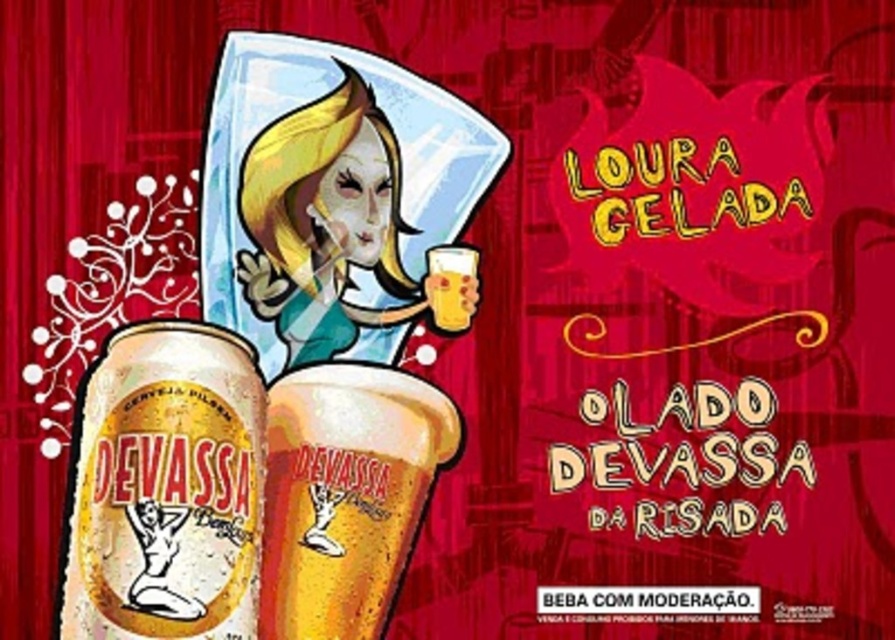
Which is below, translucent plastic cup at center or translucent glass beer at center?

translucent plastic cup at center is below.

Which is more to the right, translucent plastic cup at center or translucent glass beer at center?

translucent glass beer at center is more to the right.

This screenshot has height=640, width=895. I want to click on translucent plastic cup at center, so click(345, 493).

Is translucent plastic cup at center shorter than matte white face at center?

Correct, translucent plastic cup at center is not as tall as matte white face at center.

Consider the image. Is translucent plastic cup at center in front of matte white face at center?

Yes, translucent plastic cup at center is in front of matte white face at center.

Between point (288, 577) and point (299, 310), which one is positioned in front?

Point (288, 577) is more forward.

Where is `translucent plastic cup at center`? translucent plastic cup at center is located at coordinates tap(345, 493).

Is gold metallic can at lower left wider than translucent glass beer at center?

Yes.

Can you confirm if gold metallic can at lower left is positioned above translucent glass beer at center?

No.

Is point (84, 516) behind point (441, 308)?

That is False.

Where is `gold metallic can at lower left`? gold metallic can at lower left is located at coordinates (166, 488).